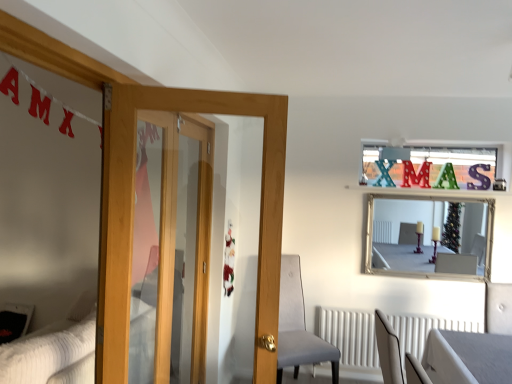
Question: In terms of width, does wooden door at left look wider or thinner when compared to metallic silver letter at upper right, the 2th letter viewed from the left?

Choices:
 (A) thin
 (B) wide

Answer: (B)

Question: Based on their positions, is wooden door at left located to the left or right of metallic silver letter at upper right, the 2th letter viewed from the left?

Choices:
 (A) right
 (B) left

Answer: (B)

Question: Which object is the closest to the metallic silver letter at upper right, the 2th letter viewed from the left?

Choices:
 (A) matte red letter m at upper center, the second letter viewed from the right
 (B) velvet grey chair at center
 (C) wooden door at left
 (D) silver/glass mirror at upper center
 (E) white textured radiator at lower center

Answer: (A)

Question: Considering the real-world distances, which object is farthest from the metallic silver letter at upper right, which appears as the 1th letter when viewed from the right?

Choices:
 (A) matte red letter m at upper center, the second letter viewed from the right
 (B) silver/glass mirror at upper center
 (C) white textured bed at lower left
 (D) white textured radiator at lower center
 (E) velvet grey chair at center

Answer: (C)